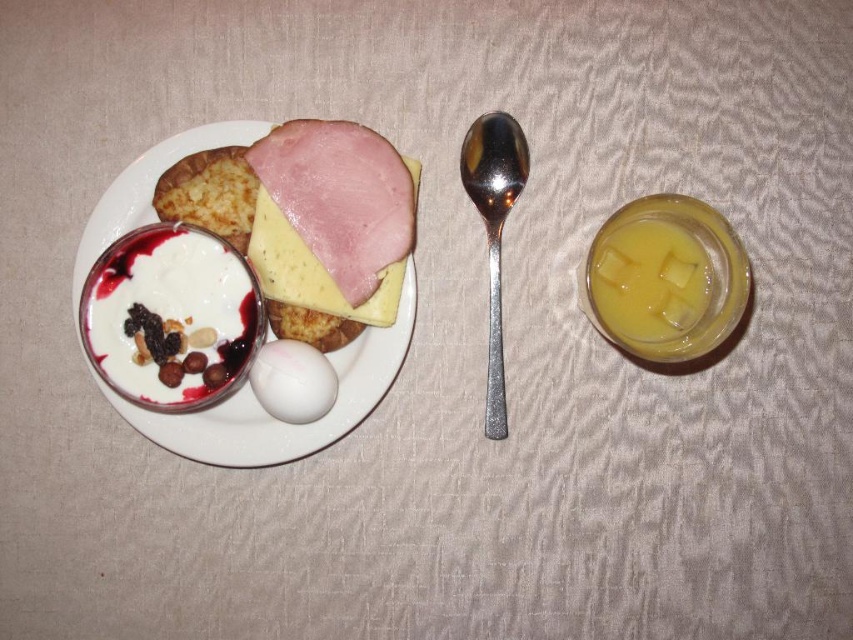
You are a chef preparing a dish and need to place a new ingredient on the table. The ingredient must be placed exactly at the coordinates given for the translucent yellow liquid at right. Where on the table should you place the new ingredient?

Answer: The new ingredient should be placed at the coordinates of the translucent yellow liquid at right, which is at point (648, 280).

Consider the image. You are a person sitting at the table and want to reach for the silver spoon on the right. There is a point marked at coordinates (171, 316). Can you tell me whether this point is closer to the silver spoon on the right or the white creamy yogurt with nuts and berries at center? Please answer based on the given coordinates and the scene description.

The point at coordinates (171, 316) is on the white creamy yogurt with nuts and berries at center, so it is closer to the yogurt than the silver spoon on the right.